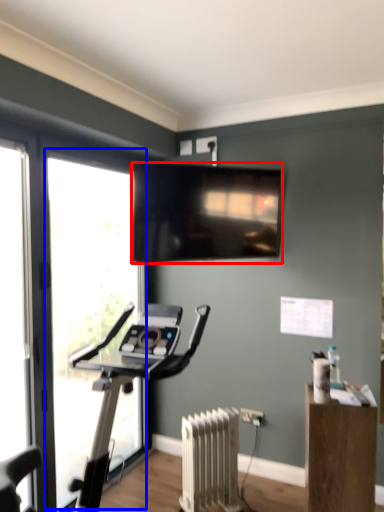
Question: Among these objects, which one is farthest to the camera, television (highlighted by a red box) or window (highlighted by a blue box)?

Choices:
 (A) television
 (B) window

Answer: (A)